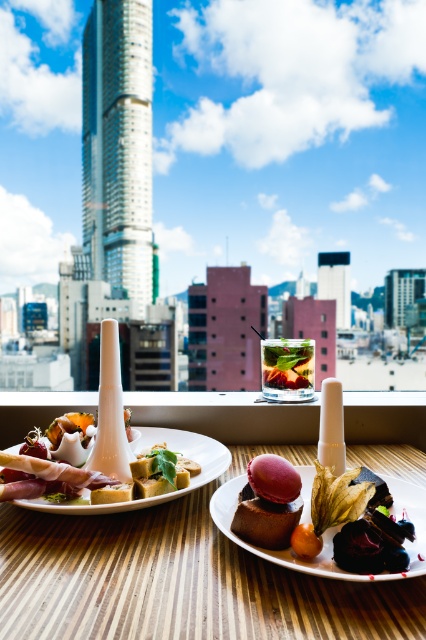
Is point (101, 627) less distant than point (314, 470)?

Yes, it is.

Does point (262, 609) come in front of point (236, 496)?

That is True.

Find the location of `wooden table at center`. wooden table at center is located at coordinates (181, 579).

Can you confirm if chocolate cake at center is positioned below matte white plate at center?

Indeed, chocolate cake at center is positioned under matte white plate at center.

Locate an element on the screen. The height and width of the screenshot is (640, 426). chocolate cake at center is located at coordinates (276, 550).

Image resolution: width=426 pixels, height=640 pixels. Find the location of `chocolate cake at center`. chocolate cake at center is located at coordinates (276, 550).

Between point (58, 636) and point (290, 490), which one is positioned behind?

The point (290, 490) is behind.

How much distance is there between wooden table at center and pink matte macaron at center?

The distance of wooden table at center from pink matte macaron at center is 3.68 inches.

This screenshot has height=640, width=426. I want to click on wooden table at center, so click(x=181, y=579).